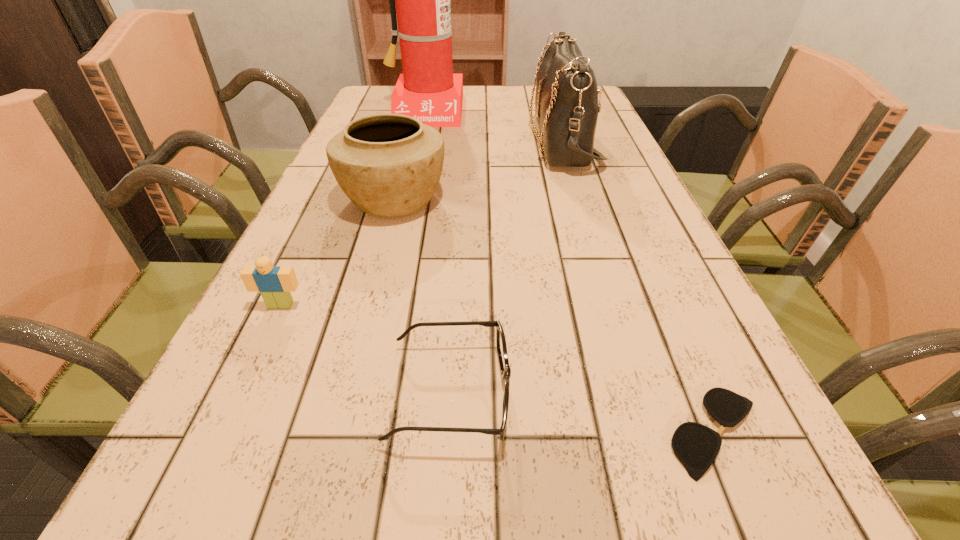
Where is `fire extinguisher`? This screenshot has width=960, height=540. fire extinguisher is located at coordinates (427, 90).

The height and width of the screenshot is (540, 960). Identify the location of handbag. (566, 100).

Find the location of a particular element. The height and width of the screenshot is (540, 960). the third tallest object is located at coordinates click(388, 165).

The image size is (960, 540). Identify the location of Lego. (275, 283).

Identify the location of the third nearest object. (275, 283).

I want to click on the second shortest object, so click(x=505, y=369).

In order to click on the taller spectacles in this screenshot , I will do `click(505, 369)`.

I want to click on the right spectacles, so click(x=696, y=446).

I want to click on the shorter spectacles, so click(696, 446).

Find the location of `vacant space located on the front-facing side of the fire extinguisher`. vacant space located on the front-facing side of the fire extinguisher is located at coordinates (416, 147).